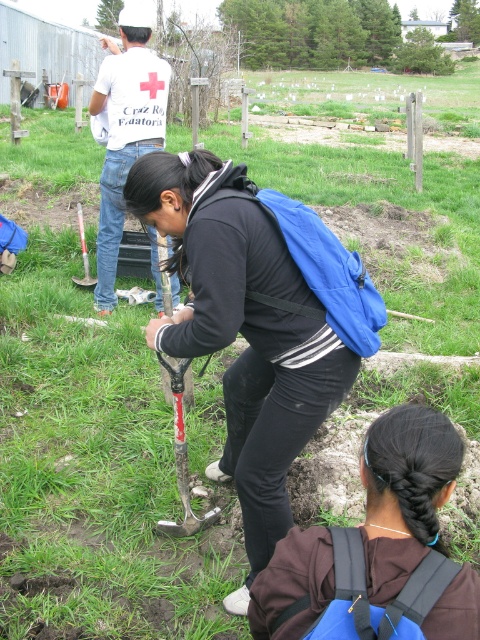
Looking at this image, you are organizing a gardening event and need to choose a shovel for digging in hard soil. Which shovel between the rusty metal shovel at center and the red plastic shovel at center would be more suitable based on their thickness?

The rusty metal shovel at center is thinner than the red plastic shovel at center, so the red plastic shovel at center would be more suitable for digging in hard soil since it is thicker and stronger.

What is the exact coordinate of the blue fabric backpack at center?

The blue fabric backpack at center is located at point (243, 330).